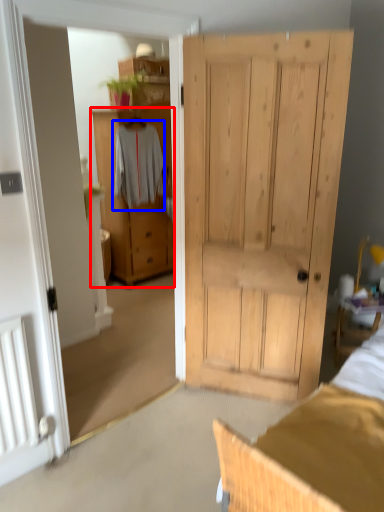
Question: Which point is further to the camera, cabinetry (highlighted by a red box) or clothing (highlighted by a blue box)?

Choices:
 (A) cabinetry
 (B) clothing

Answer: (A)